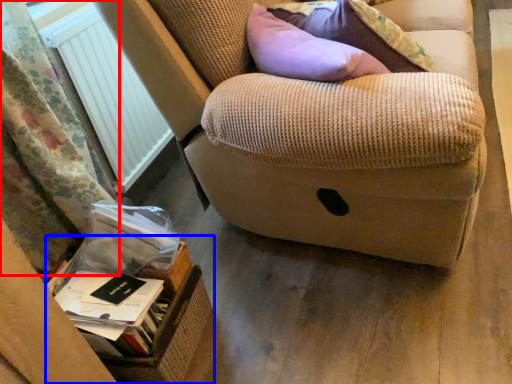
Question: Which point is further to the camera, curtain (highlighted by a red box) or cardboard box (highlighted by a blue box)?

Choices:
 (A) curtain
 (B) cardboard box

Answer: (B)